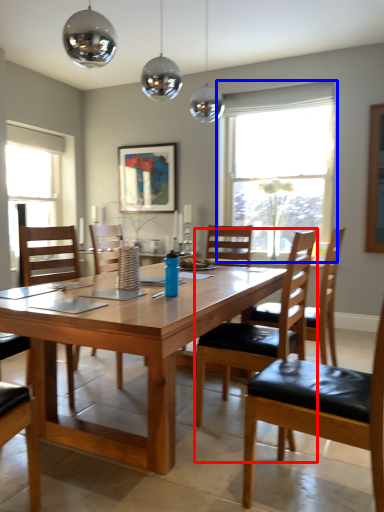
Question: Which object is closer to the camera taking this photo, chair (highlighted by a red box) or window (highlighted by a blue box)?

Choices:
 (A) chair
 (B) window

Answer: (A)